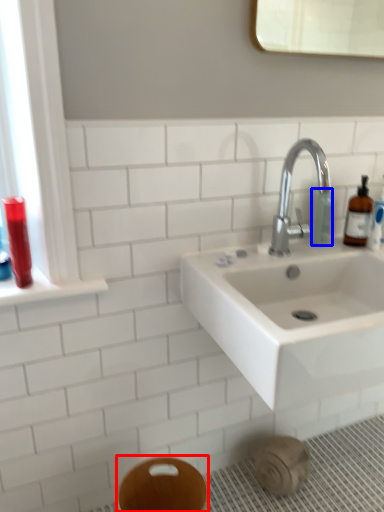
Question: Which of the following is the closest to the observer, bidet (highlighted by a red box) or toiletry (highlighted by a blue box)?

Choices:
 (A) bidet
 (B) toiletry

Answer: (A)